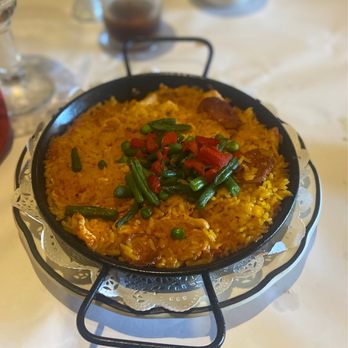
In order to click on plate in this screenshot , I will do `click(284, 259)`, `click(31, 234)`.